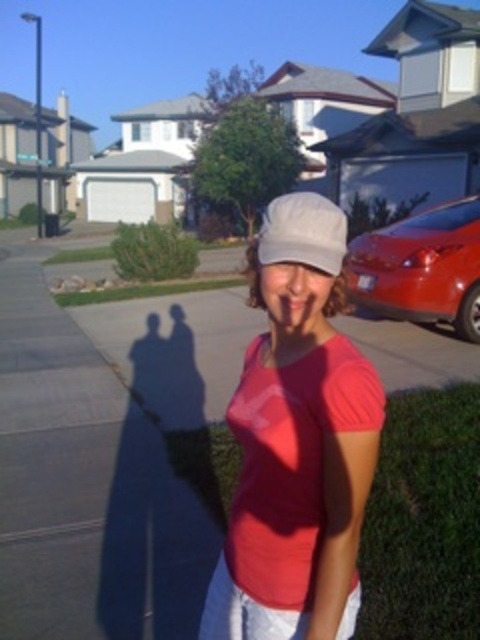
The width and height of the screenshot is (480, 640). I want to click on smooth concrete pavement at center, so click(110, 452).

Who is shorter, smooth concrete pavement at center or white matte hat at center?

With less height is white matte hat at center.

The width and height of the screenshot is (480, 640). Describe the element at coordinates (110, 452) in the screenshot. I see `smooth concrete pavement at center` at that location.

Identify the location of smooth concrete pavement at center. This screenshot has height=640, width=480. (110, 452).

Based on the photo, does matte white cap at center have a lesser height compared to shiny red car at right?

Indeed, matte white cap at center has a lesser height compared to shiny red car at right.

Identify the location of matte white cap at center. The width and height of the screenshot is (480, 640). (297, 442).

Identify the location of matte white cap at center. (297, 442).

Is point (323, 340) positioned before point (321, 221)?

No.

Where is `matte white cap at center`? matte white cap at center is located at coordinates (297, 442).

At what (x,y) coordinates should I click in order to perform the action: click on matte white cap at center. Please return your answer as a coordinate pair (x, y). The height and width of the screenshot is (640, 480). Looking at the image, I should click on (297, 442).